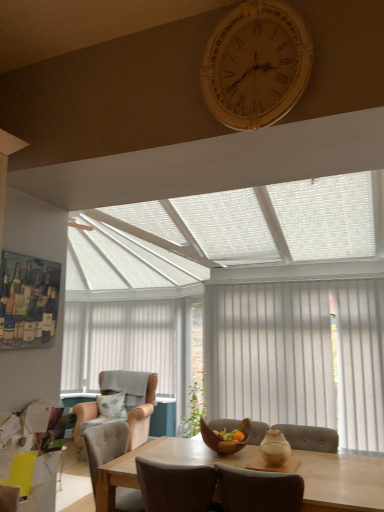
Question: From their relative heights in the image, would you say fluffy fabric pillow at center is taller or shorter than light wood table at center?

Choices:
 (A) tall
 (B) short

Answer: (B)

Question: Considering the positions of fluffy fabric pillow at center and light wood table at center in the image, is fluffy fabric pillow at center wider or thinner than light wood table at center?

Choices:
 (A) thin
 (B) wide

Answer: (A)

Question: Which of these objects is positioned farthest from the beige fabric chair at lower left, acting as the first chair starting from the top?

Choices:
 (A) beige fabric armchair at left, acting as the first chair starting from the bottom
 (B) wooden clock at upper center
 (C) fluffy fabric pillow at center
 (D) beige fabric blind at center
 (E) light wood table at center

Answer: (D)

Question: Which of these objects is positioned farthest from the wooden clock at upper center?

Choices:
 (A) beige fabric chair at lower left, placed as the second chair when sorted from back to front
 (B) white vertical blinds at right
 (C) fluffy fabric pillow at center
 (D) beige fabric armchair at left, the first chair positioned from the back
 (E) light wood table at center

Answer: (C)